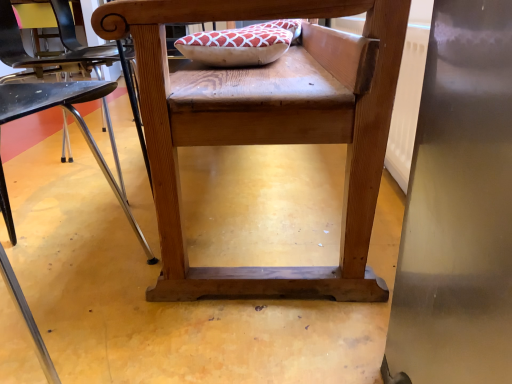
This screenshot has width=512, height=384. I want to click on vacant space to the right of wooden chair at center, the 2th chair in the right-to-left sequence, so click(x=222, y=299).